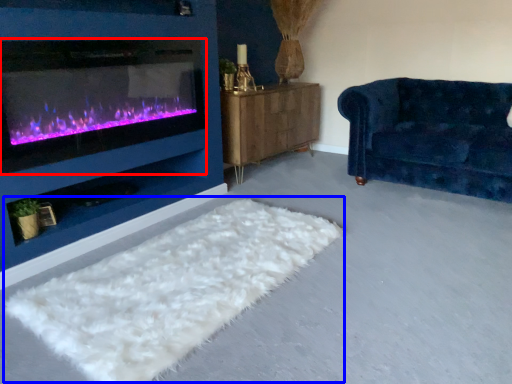
Question: Among these objects, which one is farthest to the camera, wood burning stove (highlighted by a red box) or mat (highlighted by a blue box)?

Choices:
 (A) wood burning stove
 (B) mat

Answer: (A)